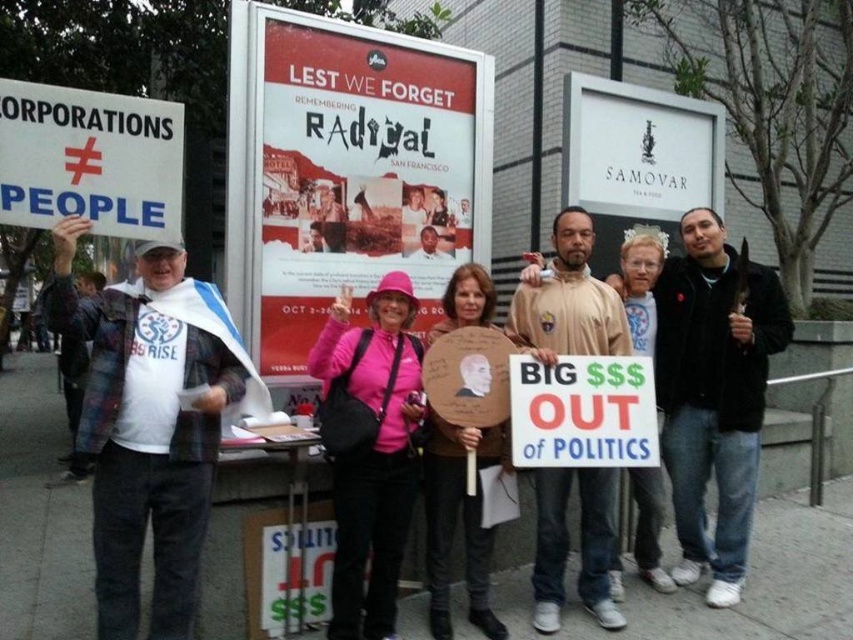
Can you confirm if pink fabric hat at center is positioned to the right of white paper sign at left?

Yes, pink fabric hat at center is to the right of white paper sign at left.

Where is `pink fabric hat at center`? pink fabric hat at center is located at coordinates (372, 452).

Does white flannel shirt at left have a larger size compared to pink fabric hat at center?

Correct, white flannel shirt at left is larger in size than pink fabric hat at center.

How distant is white flannel shirt at left from pink fabric hat at center?

The distance of white flannel shirt at left from pink fabric hat at center is 25.69 inches.

Which is behind, point (138, 528) or point (412, 497)?

Positioned behind is point (412, 497).

Image resolution: width=853 pixels, height=640 pixels. Find the location of `white flannel shirt at left`. white flannel shirt at left is located at coordinates (143, 444).

Does point (602, 368) come in front of point (445, 586)?

Yes.

Between white cardboard sign at center and pink fabric hat at upper center, which one is positioned lower?

Positioned lower is pink fabric hat at upper center.

Does point (610, 400) come behind point (468, 522)?

No, (610, 400) is closer to viewer.

This screenshot has width=853, height=640. What are the coordinates of `white cardboard sign at center` in the screenshot? It's located at (582, 412).